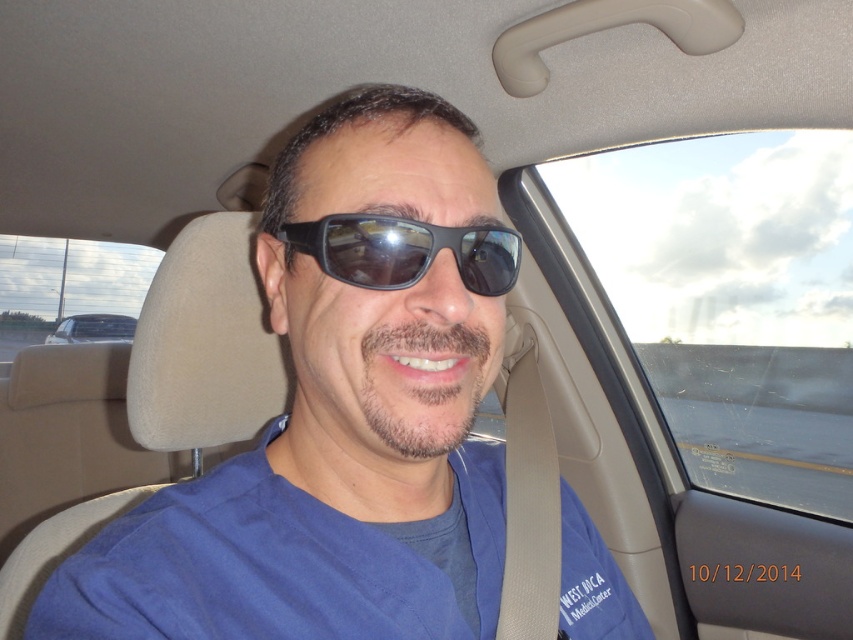
Does matte black sunglasses at center appear over black matte sunglasses at center?

Incorrect, matte black sunglasses at center is not positioned above black matte sunglasses at center.

Image resolution: width=853 pixels, height=640 pixels. In order to click on matte black sunglasses at center in this screenshot , I will do `click(340, 412)`.

The image size is (853, 640). In order to click on black matte sunglasses at center in this screenshot , I will do `click(405, 250)`.

Is point (505, 257) less distant than point (65, 328)?

Yes, it is.

Where is `black matte sunglasses at center`? black matte sunglasses at center is located at coordinates (405, 250).

This screenshot has height=640, width=853. Describe the element at coordinates (340, 412) in the screenshot. I see `matte black sunglasses at center` at that location.

Between matte black sunglasses at center and metallic silver car at left, which one has more height?

matte black sunglasses at center

At what (x,y) coordinates should I click in order to perform the action: click on matte black sunglasses at center. Please return your answer as a coordinate pair (x, y). The image size is (853, 640). Looking at the image, I should click on (340, 412).